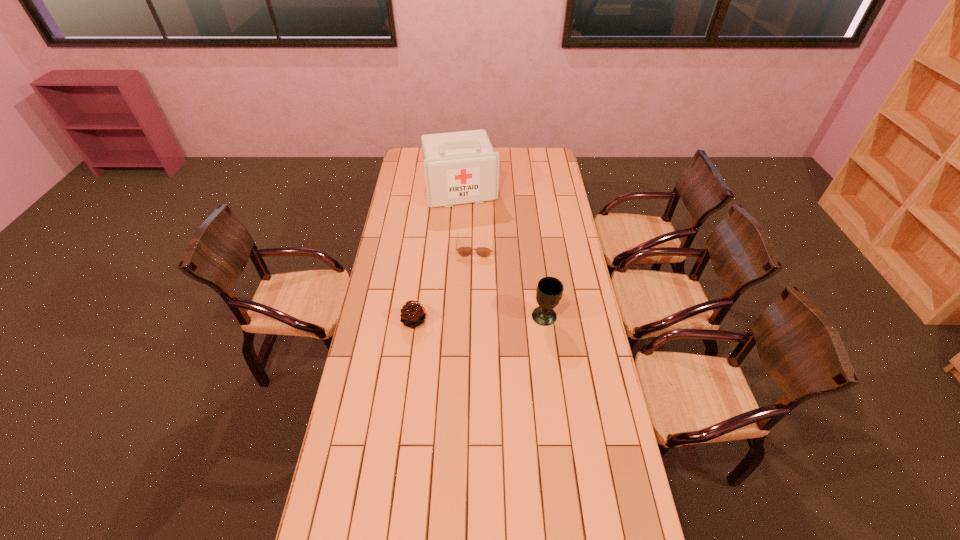
Locate an element on the screen. pinecone is located at coordinates (413, 314).

This screenshot has width=960, height=540. What are the coordinates of `the second tallest object` in the screenshot? It's located at (549, 291).

This screenshot has width=960, height=540. Identify the location of chalice. (549, 291).

This screenshot has height=540, width=960. Find the location of `the farthest object`. the farthest object is located at coordinates (462, 167).

I want to click on the tallest object, so click(462, 167).

The width and height of the screenshot is (960, 540). What are the coordinates of `the shortest object` in the screenshot? It's located at (464, 251).

The image size is (960, 540). I want to click on the third nearest object, so click(464, 251).

I want to click on vacant region located 0.250m with a leaf charm attached to the pinecone, so click(493, 321).

Locate an element on the screen. free space located on the front of the rightmost object is located at coordinates tap(549, 349).

Find the location of a particular element. The image size is (960, 540). vacant region located on the front-facing side of the farthest object is located at coordinates (473, 230).